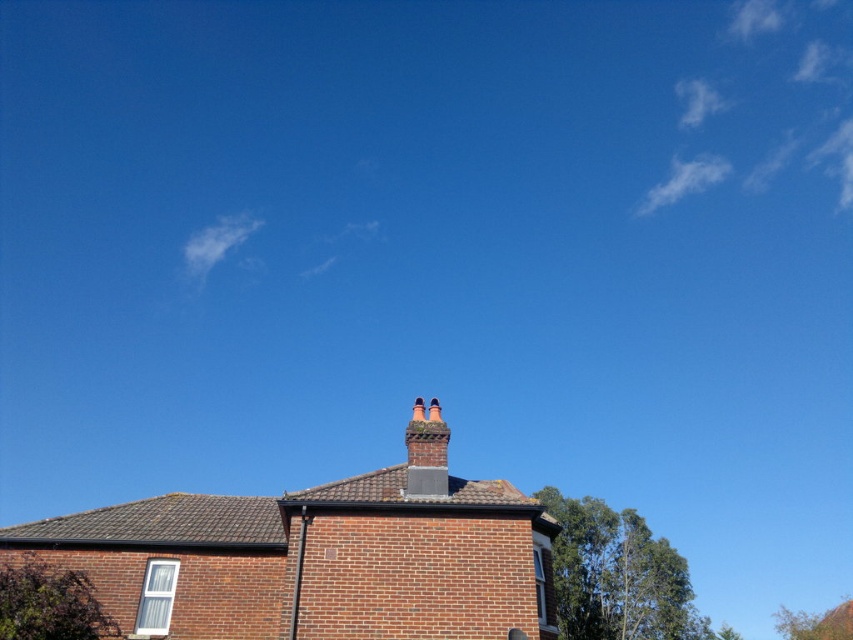
You are standing in a garden looking at the green leafy tree at lower left and the red brick chimney at center. Which object would appear larger to you?

The green leafy tree at lower left appears larger because it is closer to the viewer than the red brick chimney at center.

You are planning to install a new satellite dish on the side of the red brick chimney at center. Considering the space occupied by the green leafy tree at lower left, will the tree block the satellite dish from receiving a signal?

The green leafy tree at lower left has a larger width than the red brick chimney at center. This means the tree might block the satellite dish on the chimney from receiving a signal due to its broader coverage area.

You are standing in front of the brick building and looking towards the greenery. Which green leafy tree is positioned to the left when comparing the green leafy tree at upper right and the green leafy tree at lower right?

The green leafy tree at upper right is positioned to the left of the green leafy tree at lower right.